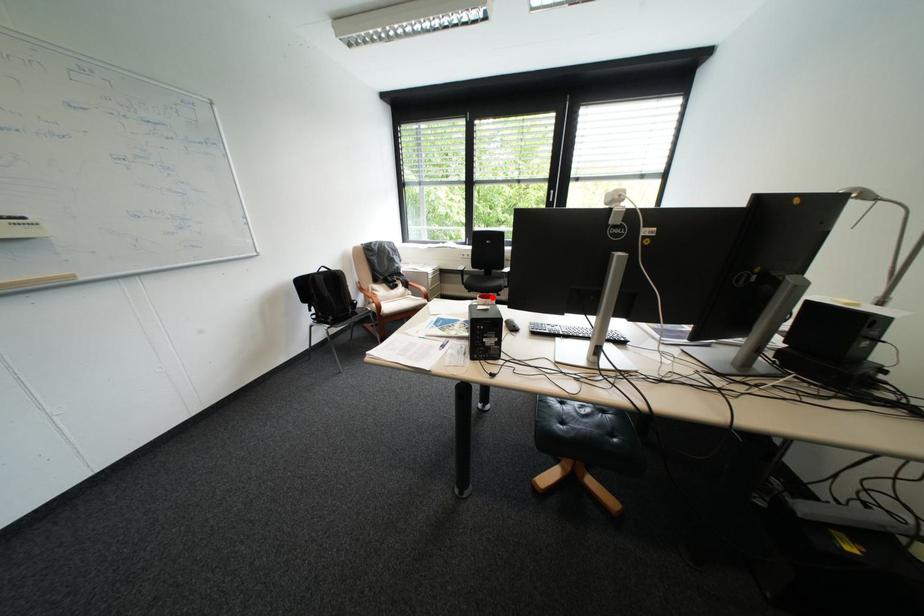
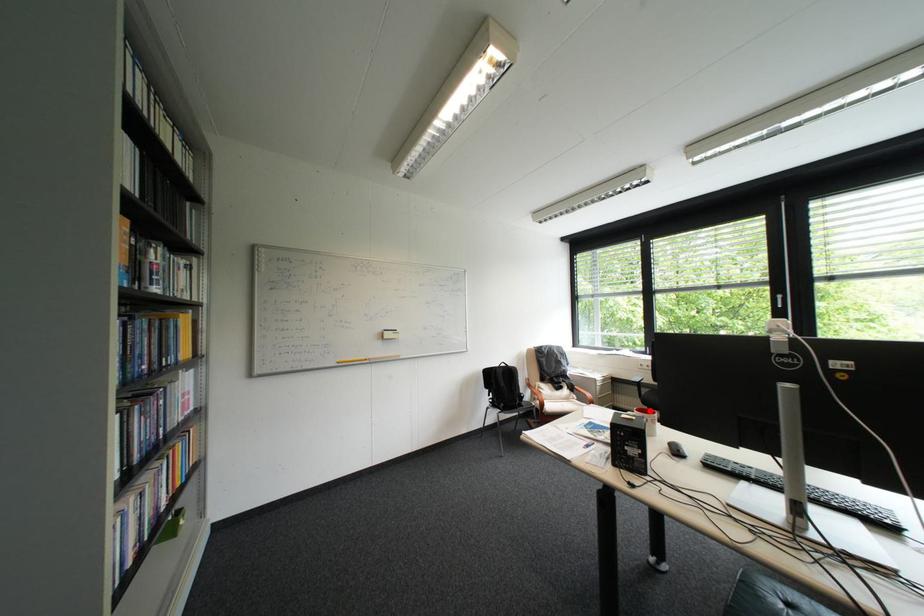
I am providing you with two images of the same scene from different viewpoints. A red point is marked on the first image and another point is marked on the second image. Is the red point in image1 aligned with the point shown in image2?

Yes